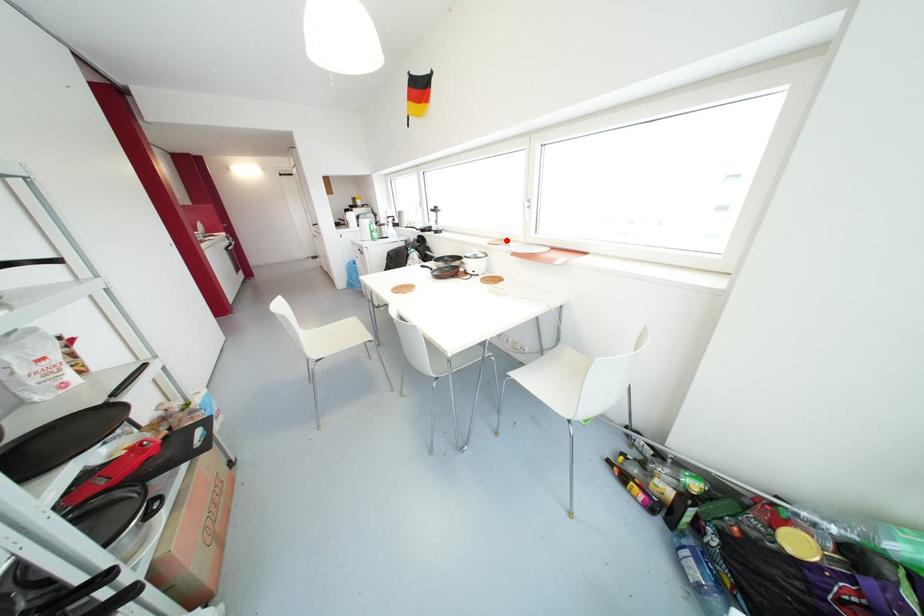
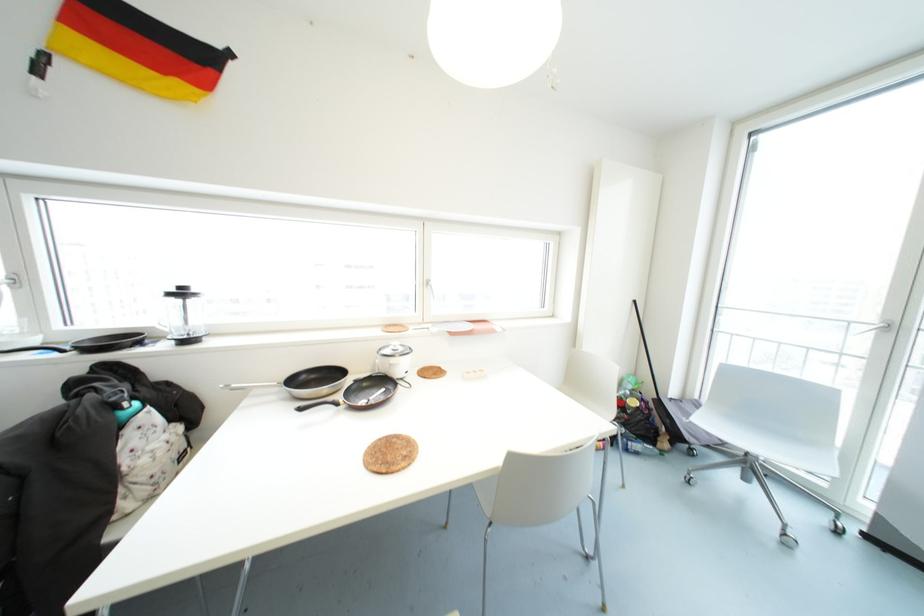
Locate, in the second image, the point that corresponds to the highlighted location in the first image.

(399, 325)